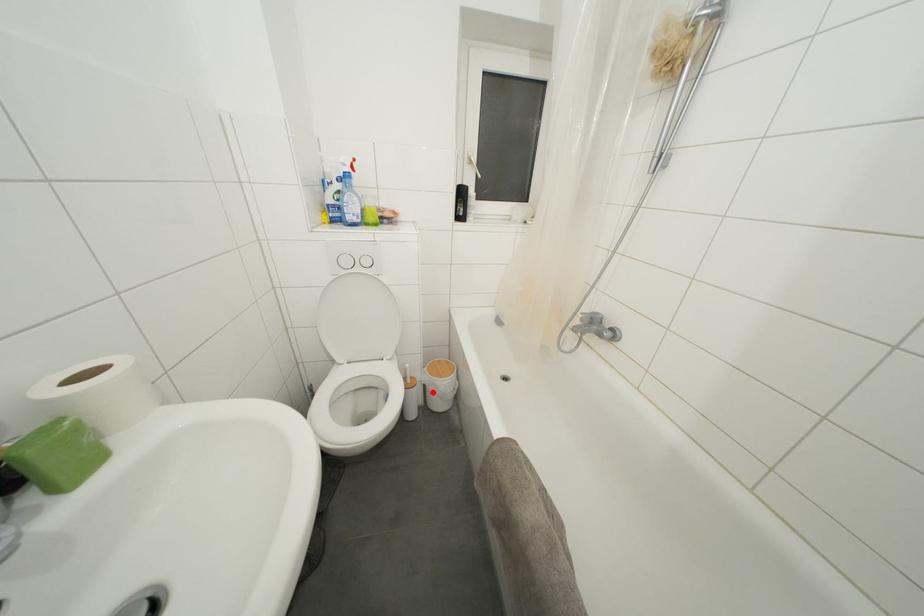
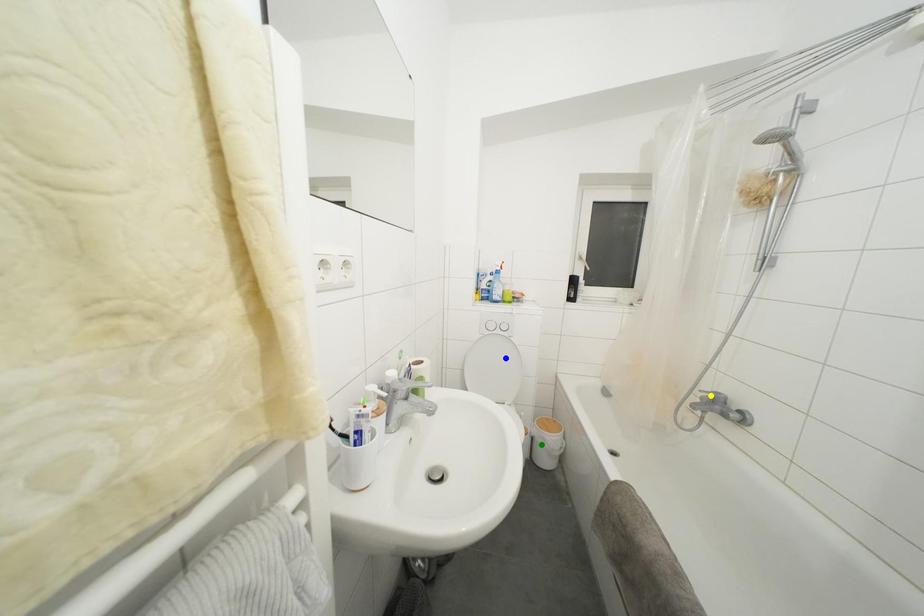
Question: I am providing you with two images of the same scene from different viewpoints. A red point is marked on the first image. You are given multiple points on the second image. Which spot in image 2 lines up with the point in image 1?

Choices:
 (A) yellow point
 (B) blue point
 (C) green point

Answer: (C)